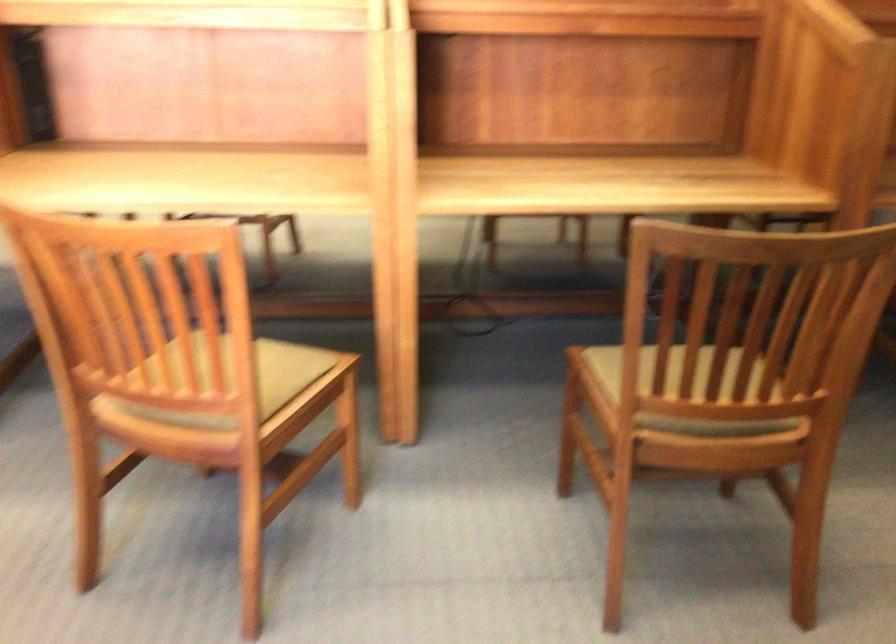
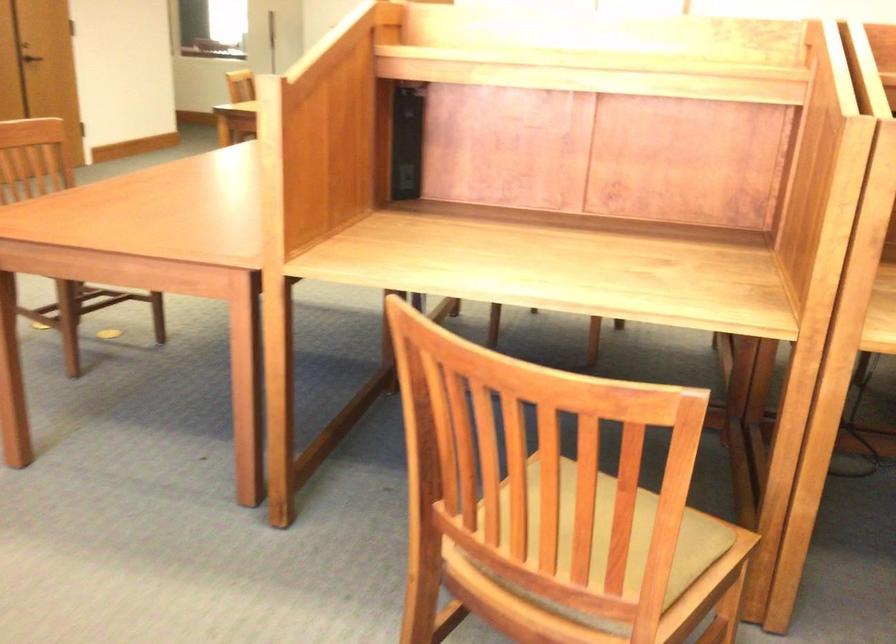
In a continuous first-person perspective shot, in which direction is the camera moving?

The movement direction of the cameraman is left, forward.